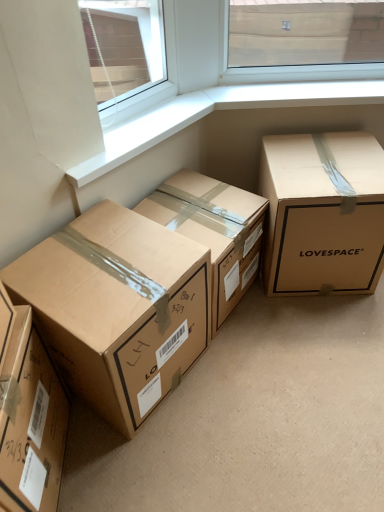
The width and height of the screenshot is (384, 512). What are the coordinates of `empty space that is ontop of brown cardboard box at center, which is counted as the third box, starting from the left (from a real-world perspective)` in the screenshot? It's located at (188, 213).